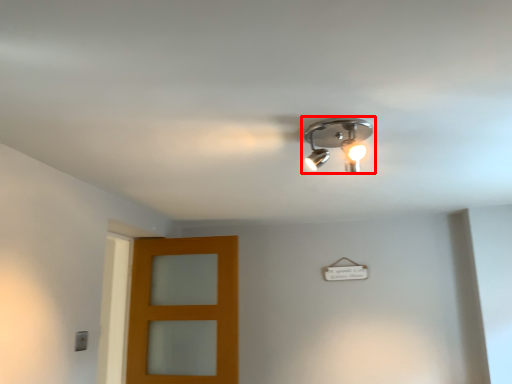
Question: From the image's perspective, what is the correct spatial relationship of lamp (annotated by the red box) in relation to door?

Choices:
 (A) above
 (B) below

Answer: (A)